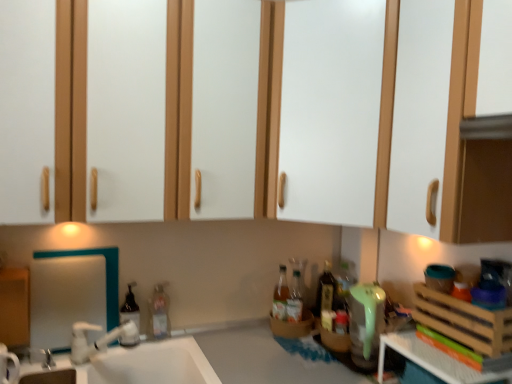
Question: From a real-world perspective, is white glossy sink at lower left on top of translucent plastic bottle at sink, which ranks as the 3th bottle in right-to-left order?

Choices:
 (A) no
 (B) yes

Answer: (A)

Question: Is white glossy sink at lower left not within translucent plastic bottle at sink, which ranks as the 3th bottle in right-to-left order?

Choices:
 (A) no
 (B) yes

Answer: (B)

Question: From the image's perspective, is white glossy sink at lower left above translucent plastic bottle at sink, which ranks as the 3th bottle in right-to-left order?

Choices:
 (A) yes
 (B) no

Answer: (B)

Question: Considering the relative sizes of white glossy sink at lower left and translucent plastic bottle at sink, which ranks as the 3th bottle in right-to-left order, in the image provided, is white glossy sink at lower left wider than translucent plastic bottle at sink, which ranks as the 3th bottle in right-to-left order,?

Choices:
 (A) no
 (B) yes

Answer: (B)

Question: Would you consider white glossy sink at lower left to be distant from translucent plastic bottle at sink, which ranks as the 3th bottle in right-to-left order?

Choices:
 (A) yes
 (B) no

Answer: (B)

Question: Is point (295, 271) closer or farther from the camera than point (151, 370)?

Choices:
 (A) closer
 (B) farther

Answer: (B)

Question: Relative to white glossy sink at lower left, is translucent glass bottles at right, positioned as the second bottle in right-to-left order, in front or behind?

Choices:
 (A) behind
 (B) front

Answer: (A)

Question: In terms of size, does translucent glass bottles at right, positioned as the third bottle in left-to-right order, appear bigger or smaller than white glossy sink at lower left?

Choices:
 (A) big
 (B) small

Answer: (B)

Question: Is translucent glass bottles at right, positioned as the third bottle in left-to-right order, wider or thinner than white glossy sink at lower left?

Choices:
 (A) thin
 (B) wide

Answer: (A)

Question: In the image, is translucent glass bottles at right, positioned as the third bottle in left-to-right order, on the left side or the right side of brown woven basket at lower center, the third basket positioned from the right?

Choices:
 (A) left
 (B) right

Answer: (B)

Question: In terms of height, does translucent glass bottles at right, positioned as the second bottle in right-to-left order, look taller or shorter compared to brown woven basket at lower center, the third basket positioned from the right?

Choices:
 (A) short
 (B) tall

Answer: (B)

Question: Considering the positions of point (295, 311) and point (308, 319), is point (295, 311) closer or farther from the camera than point (308, 319)?

Choices:
 (A) closer
 (B) farther

Answer: (A)

Question: Looking at the image, does translucent glass bottles at right, positioned as the third bottle in left-to-right order, seem bigger or smaller compared to brown woven basket at lower center, the third basket positioned from the right?

Choices:
 (A) big
 (B) small

Answer: (B)

Question: From the image's perspective, is white glossy mirror at left above or below wooden basket at lower right, which is the 2th basket from front to back?

Choices:
 (A) above
 (B) below

Answer: (A)

Question: From a real-world perspective, relative to wooden basket at lower right, the 3th basket viewed from the top, is white glossy mirror at left vertically above or below?

Choices:
 (A) below
 (B) above

Answer: (B)